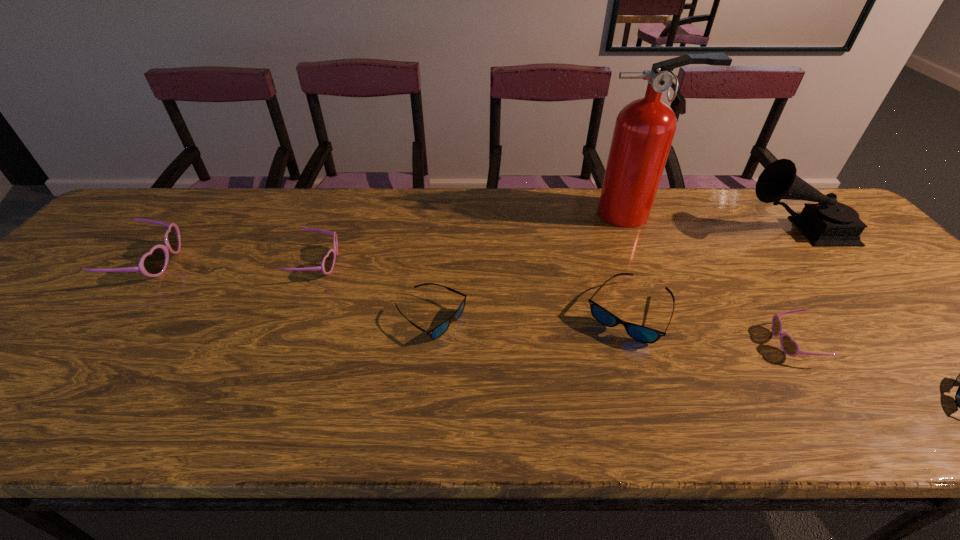
The image size is (960, 540). Identify the location of free region located on the front-facing side of the fifth sunglasses from left to right. (629, 343).

I want to click on free space located 0.290m on the front-facing side of the fifth sunglasses from left to right, so click(x=642, y=343).

The image size is (960, 540). Identify the location of vacant space located on the front-facing side of the fifth sunglasses from left to right. (660, 343).

I want to click on free space located 0.100m at the front of the sixth object from right to left showing the lenses, so (x=510, y=318).

This screenshot has height=540, width=960. Find the location of `fire extinguisher present at the far edge`. fire extinguisher present at the far edge is located at coordinates (644, 130).

You are a GUI agent. You are given a task and a screenshot of the screen. Output one action in this format:
    pyautogui.click(x=<x>, y=<y>)
    Task: Click on the phonograph_record at the far edge
    
    Given the screenshot: What is the action you would take?
    pyautogui.click(x=828, y=223)

Locate an element on the screen. object that is positioned at the left edge is located at coordinates (153, 263).

Where is `object that is at the right edge`? object that is at the right edge is located at coordinates (828, 223).

At what (x,y) coordinates should I click in order to perform the action: click on object that is at the far right corner. Please return your answer as a coordinate pair (x, y). Looking at the image, I should click on (828, 223).

This screenshot has width=960, height=540. I want to click on vacant region at the far edge, so click(x=491, y=217).